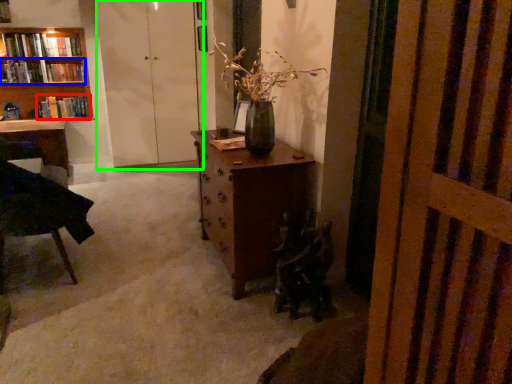
Question: Which is nearer to the book (highlighted by a red box)? book (highlighted by a blue box) or screen door (highlighted by a green box).

Choices:
 (A) book
 (B) screen door

Answer: (A)